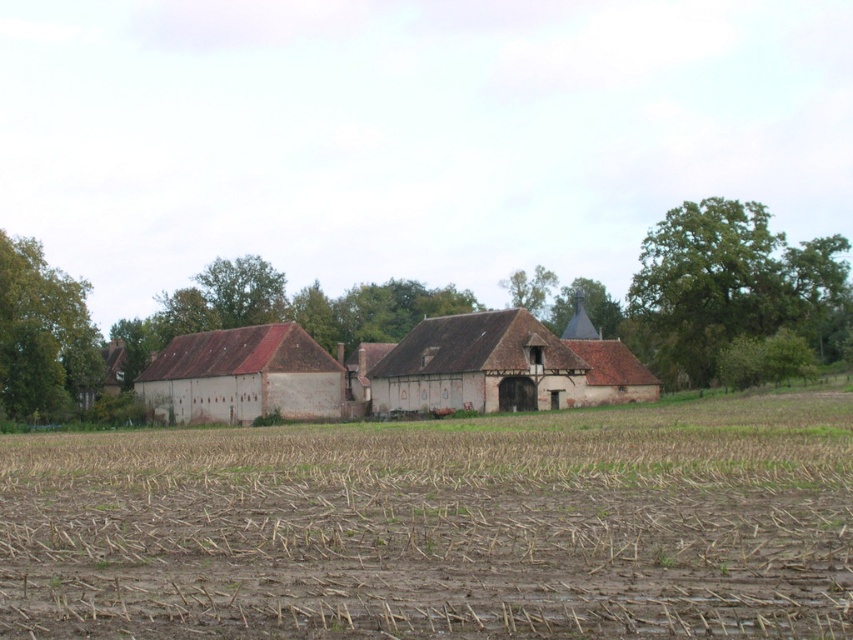
Can you confirm if green textured roof at center is positioned below green leafy tree at upper center?

Yes, green textured roof at center is below green leafy tree at upper center.

The width and height of the screenshot is (853, 640). Describe the element at coordinates (585, 307) in the screenshot. I see `green textured roof at center` at that location.

This screenshot has width=853, height=640. Find the location of `green textured roof at center`. green textured roof at center is located at coordinates (585, 307).

Does brown wooden barn at center have a lesser width compared to green textured roof at center?

Yes.

Where is `brown wooden barn at center`? The height and width of the screenshot is (640, 853). brown wooden barn at center is located at coordinates (477, 365).

Is brown soil at center in front of green leafy tree at upper center?

Yes, brown soil at center is in front of green leafy tree at upper center.

Describe the element at coordinates (440, 525) in the screenshot. I see `brown soil at center` at that location.

Identify the location of brown soil at center. The width and height of the screenshot is (853, 640). (440, 525).